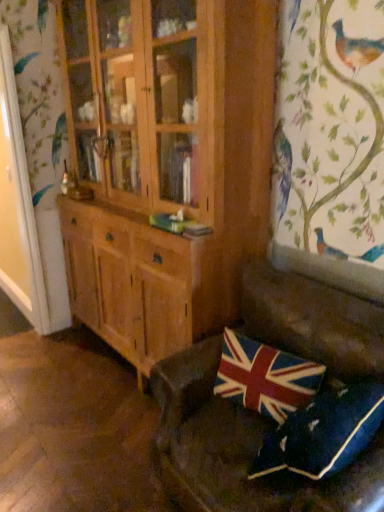
This screenshot has height=512, width=384. I want to click on wooden cabinet at center, so click(x=145, y=170).

Where is `union jack fabric pillow at lower right, which appears as the first pillow when viewed from the back`? Image resolution: width=384 pixels, height=512 pixels. union jack fabric pillow at lower right, which appears as the first pillow when viewed from the back is located at coordinates (265, 377).

This screenshot has width=384, height=512. Describe the element at coordinates (323, 433) in the screenshot. I see `velvet union jack pillow at lower right, the second pillow when ordered from back to front` at that location.

The width and height of the screenshot is (384, 512). Identify the location of leather couch at lower right. (239, 449).

Where is `wooden cabinet at center`? Image resolution: width=384 pixels, height=512 pixels. wooden cabinet at center is located at coordinates (145, 170).

Can you confirm if union jack fabric pillow at lower right, the 2th pillow positioned from the front, is positioned to the right of velvet union jack pillow at lower right, the second pillow when ordered from back to front?

In fact, union jack fabric pillow at lower right, the 2th pillow positioned from the front, is to the left of velvet union jack pillow at lower right, the second pillow when ordered from back to front.

Which of these two, union jack fabric pillow at lower right, the 2th pillow positioned from the front, or velvet union jack pillow at lower right, which appears as the first pillow when viewed from the front, is thinner?

union jack fabric pillow at lower right, the 2th pillow positioned from the front.

In terms of height, does union jack fabric pillow at lower right, the 2th pillow positioned from the front, look taller or shorter compared to velvet union jack pillow at lower right, the second pillow when ordered from back to front?

union jack fabric pillow at lower right, the 2th pillow positioned from the front, is shorter than velvet union jack pillow at lower right, the second pillow when ordered from back to front.

Which is behind, point (277, 408) or point (333, 411)?

The point (277, 408) is behind.

In the image, is union jack fabric pillow at lower right, which appears as the first pillow when viewed from the back, on the left side or the right side of leather couch at lower right?

From the image, it's evident that union jack fabric pillow at lower right, which appears as the first pillow when viewed from the back, is to the left of leather couch at lower right.

Do you think union jack fabric pillow at lower right, the 2th pillow positioned from the front, is within leather couch at lower right, or outside of it?

union jack fabric pillow at lower right, the 2th pillow positioned from the front, can be found inside leather couch at lower right.

Which of these two, union jack fabric pillow at lower right, which appears as the first pillow when viewed from the back, or leather couch at lower right, is wider?

With larger width is leather couch at lower right.

Identify the location of studio couch below the union jack fabric pillow at lower right, the 2th pillow positioned from the front (from the image's perspective). (239, 449).

Considering the sizes of objects leather couch at lower right and velvet union jack pillow at lower right, the second pillow when ordered from back to front, in the image provided, who is wider, leather couch at lower right or velvet union jack pillow at lower right, the second pillow when ordered from back to front,?

Wider between the two is leather couch at lower right.

Consider the image. Considering the sizes of leather couch at lower right and velvet union jack pillow at lower right, the second pillow when ordered from back to front, in the image, is leather couch at lower right taller or shorter than velvet union jack pillow at lower right, the second pillow when ordered from back to front,?

Considering their sizes, leather couch at lower right has more height than velvet union jack pillow at lower right, the second pillow when ordered from back to front.

Locate an element on the screen. studio couch above the velvet union jack pillow at lower right, which appears as the first pillow when viewed from the front (from the image's perspective) is located at coordinates (239, 449).

How many degrees apart are the facing directions of leather couch at lower right and velvet union jack pillow at lower right, the second pillow when ordered from back to front?

The angular difference between leather couch at lower right and velvet union jack pillow at lower right, the second pillow when ordered from back to front, is 90 degrees.

How distant is velvet union jack pillow at lower right, the second pillow when ordered from back to front, from leather couch at lower right?

7.57 inches.

Can you confirm if velvet union jack pillow at lower right, the second pillow when ordered from back to front, is positioned to the right of leather couch at lower right?

No.

From a real-world perspective, does velvet union jack pillow at lower right, which appears as the first pillow when viewed from the front, sit lower than leather couch at lower right?

No, from a real-world perspective, velvet union jack pillow at lower right, which appears as the first pillow when viewed from the front, is not below leather couch at lower right.

From the image's perspective, is velvet union jack pillow at lower right, the second pillow when ordered from back to front, beneath leather couch at lower right?

Yes.

Which object is positioned more to the right, wooden cabinet at center or velvet union jack pillow at lower right, which appears as the first pillow when viewed from the front?

Positioned to the right is velvet union jack pillow at lower right, which appears as the first pillow when viewed from the front.

Does point (164, 31) appear closer or farther from the camera than point (299, 436)?

Point (164, 31).

Would you say wooden cabinet at center is outside velvet union jack pillow at lower right, which appears as the first pillow when viewed from the front?

Yes, wooden cabinet at center is located beyond the bounds of velvet union jack pillow at lower right, which appears as the first pillow when viewed from the front.

From a real-world perspective, is velvet union jack pillow at lower right, the second pillow when ordered from back to front, positioned under wooden cabinet at center based on gravity?

Correct, in the physical world, velvet union jack pillow at lower right, the second pillow when ordered from back to front, is lower than wooden cabinet at center.

Between velvet union jack pillow at lower right, the second pillow when ordered from back to front, and wooden cabinet at center, which one appears on the left side from the viewer's perspective?

Positioned to the left is wooden cabinet at center.

Is wooden cabinet at center at the back of velvet union jack pillow at lower right, which appears as the first pillow when viewed from the front?

No, velvet union jack pillow at lower right, which appears as the first pillow when viewed from the front, is not facing away from wooden cabinet at center.

Is velvet union jack pillow at lower right, which appears as the first pillow when viewed from the front, bigger or smaller than wooden cabinet at center?

Considering their sizes, velvet union jack pillow at lower right, which appears as the first pillow when viewed from the front, takes up less space than wooden cabinet at center.

Between union jack fabric pillow at lower right, which appears as the first pillow when viewed from the back, and wooden cabinet at center, which one has smaller size?

With smaller size is union jack fabric pillow at lower right, which appears as the first pillow when viewed from the back.

From the image's perspective, who appears lower, union jack fabric pillow at lower right, which appears as the first pillow when viewed from the back, or wooden cabinet at center?

union jack fabric pillow at lower right, which appears as the first pillow when viewed from the back, appears lower in the image.

In the scene shown: Between union jack fabric pillow at lower right, the 2th pillow positioned from the front, and wooden cabinet at center, which one appears on the left side from the viewer's perspective?

wooden cabinet at center is more to the left.

Find the location of a particular element. The height and width of the screenshot is (512, 384). pillow lying behind the velvet union jack pillow at lower right, the second pillow when ordered from back to front is located at coordinates (x=265, y=377).

You are a GUI agent. You are given a task and a screenshot of the screen. Output one action in this format:
    pyautogui.click(x=<x>, y=<y>)
    Task: Click on the studio couch below the union jack fabric pillow at lower right, which appears as the first pillow when viewed from the back (from the image's perspective)
    
    Given the screenshot: What is the action you would take?
    pyautogui.click(x=239, y=449)

Looking at the image, which one is located further to velvet union jack pillow at lower right, the second pillow when ordered from back to front, wooden cabinet at center or leather couch at lower right?

Based on the image, wooden cabinet at center appears to be further to velvet union jack pillow at lower right, the second pillow when ordered from back to front.

Estimate the real-world distances between objects in this image. Which object is further from wooden cabinet at center, union jack fabric pillow at lower right, the 2th pillow positioned from the front, or leather couch at lower right?

Based on the image, union jack fabric pillow at lower right, the 2th pillow positioned from the front, appears to be further to wooden cabinet at center.

From the image, which object appears to be nearer to wooden cabinet at center, leather couch at lower right or union jack fabric pillow at lower right, the 2th pillow positioned from the front?

leather couch at lower right lies closer to wooden cabinet at center than the other object.

Estimate the real-world distances between objects in this image. Which object is closer to union jack fabric pillow at lower right, which appears as the first pillow when viewed from the back, leather couch at lower right or velvet union jack pillow at lower right, which appears as the first pillow when viewed from the front?

leather couch at lower right.

In the scene shown: Which object lies nearer to the anchor point union jack fabric pillow at lower right, the 2th pillow positioned from the front, leather couch at lower right or wooden cabinet at center?

Among the two, leather couch at lower right is located nearer to union jack fabric pillow at lower right, the 2th pillow positioned from the front.

Estimate the real-world distances between objects in this image. Which object is further from union jack fabric pillow at lower right, the 2th pillow positioned from the front, velvet union jack pillow at lower right, which appears as the first pillow when viewed from the front, or wooden cabinet at center?

Among the two, wooden cabinet at center is located further to union jack fabric pillow at lower right, the 2th pillow positioned from the front.

Consider the image. When comparing their distances from leather couch at lower right, does union jack fabric pillow at lower right, the 2th pillow positioned from the front, or velvet union jack pillow at lower right, which appears as the first pillow when viewed from the front, seem further?

velvet union jack pillow at lower right, which appears as the first pillow when viewed from the front, lies further to leather couch at lower right than the other object.

Looking at the image, which one is located further to leather couch at lower right, velvet union jack pillow at lower right, which appears as the first pillow when viewed from the front, or wooden cabinet at center?

wooden cabinet at center is positioned further to the anchor leather couch at lower right.

This screenshot has width=384, height=512. I want to click on pillow between wooden cabinet at center and leather couch at lower right in the up-down direction, so click(x=265, y=377).

Locate an element on the screen. pillow between leather couch at lower right and union jack fabric pillow at lower right, which appears as the first pillow when viewed from the back, along the z-axis is located at coordinates (323, 433).

The image size is (384, 512). What are the coordinates of `pillow between wooden cabinet at center and velvet union jack pillow at lower right, the second pillow when ordered from back to front, in the vertical direction` in the screenshot? It's located at (265, 377).

Where is `studio couch that lies between wooden cabinet at center and velvet union jack pillow at lower right, the second pillow when ordered from back to front, from top to bottom`? This screenshot has width=384, height=512. studio couch that lies between wooden cabinet at center and velvet union jack pillow at lower right, the second pillow when ordered from back to front, from top to bottom is located at coordinates (239, 449).